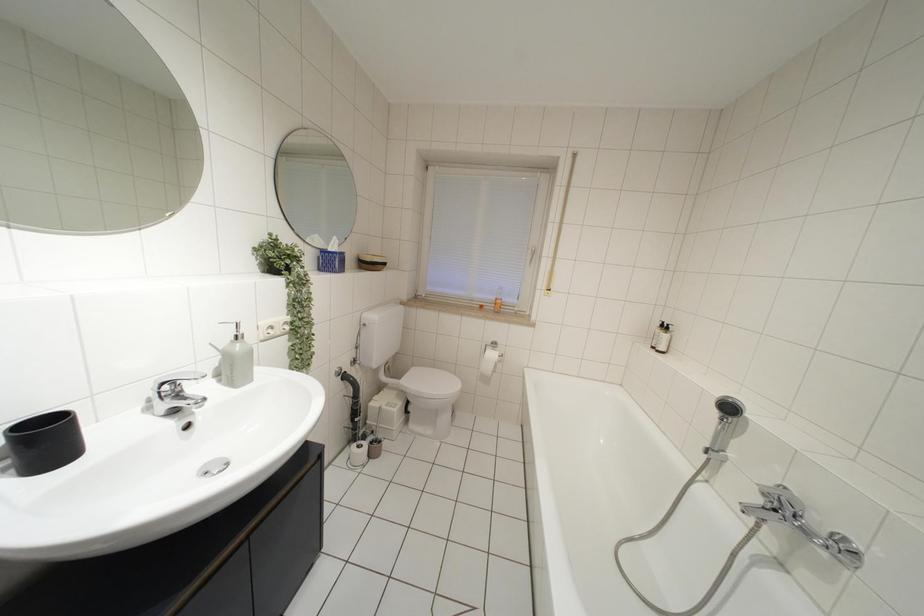
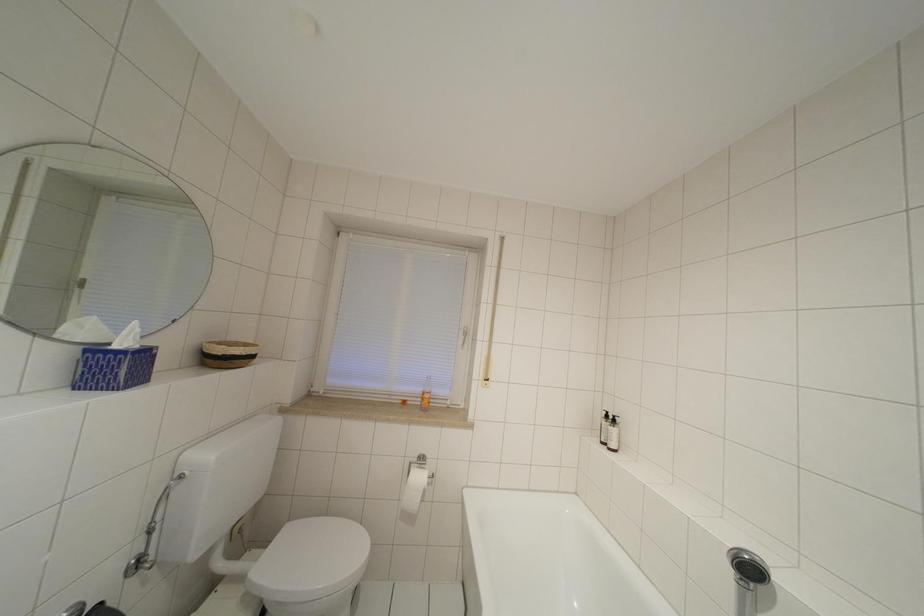
Question: What movement of the cameraman would produce the second image?

Choices:
 (A) Left
 (B) Right
 (C) Forward
 (D) Backward

Answer: (C)